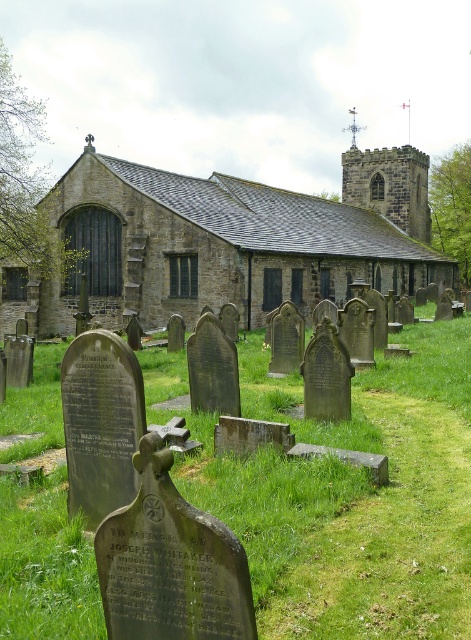
Can you confirm if green grass at center is taller than brown stone church at center?

No.

Where is `green grass at center`? The height and width of the screenshot is (640, 471). green grass at center is located at coordinates (347, 492).